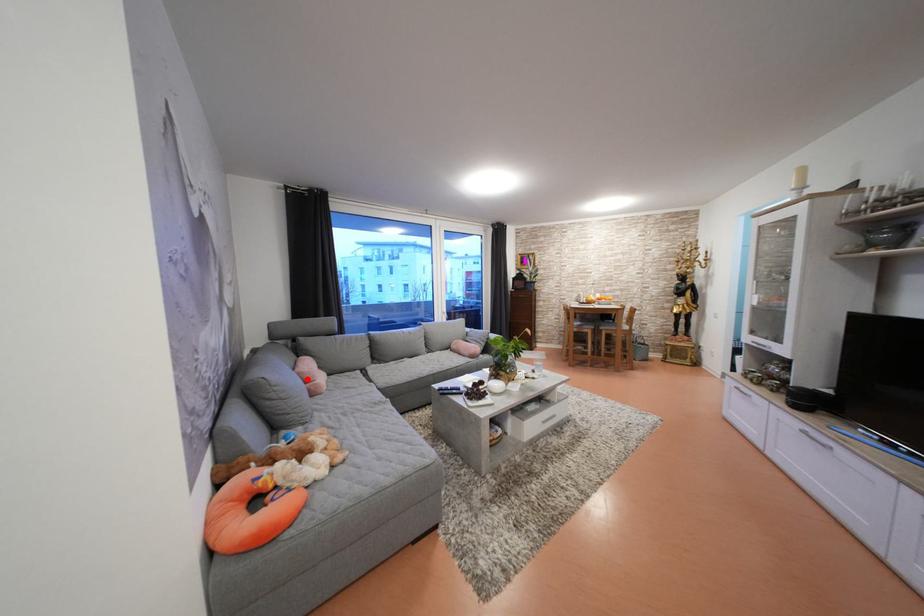
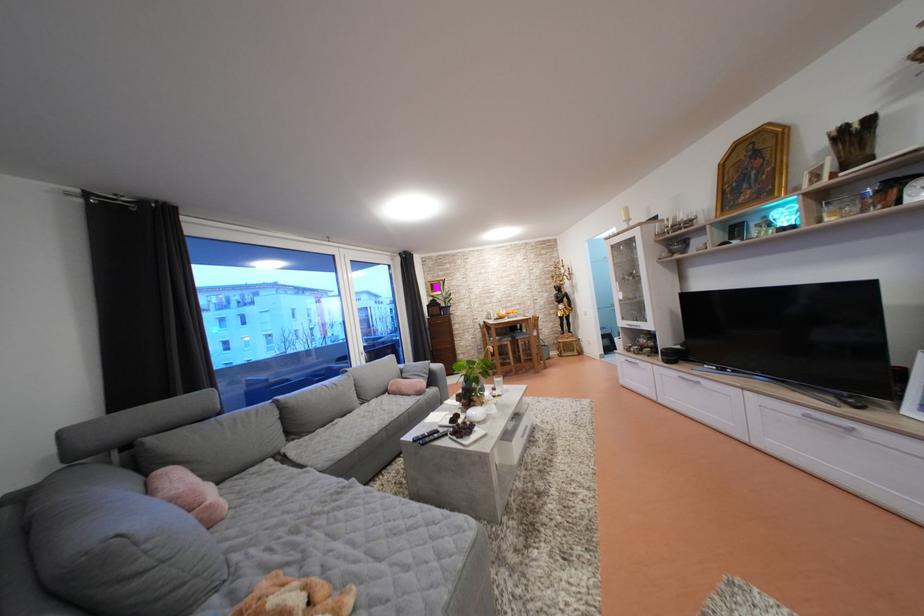
Where in the second image is the point corresponding to the highlighted location from the first image?

(180, 505)